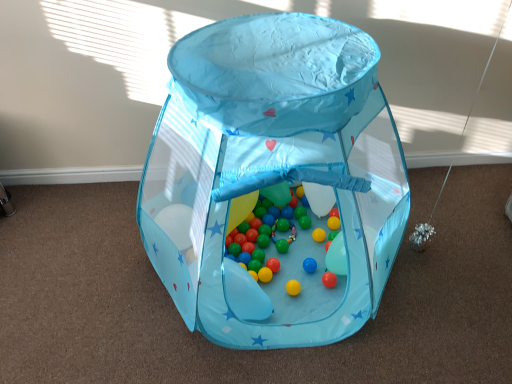
Question: Is transparent fabric play tent at center, which ranks as the second toy in bottom-to-top order, not close to translucent plastic balloon at center?

Choices:
 (A) yes
 (B) no

Answer: (B)

Question: Considering the relative sizes of transparent fabric play tent at center, which is the 1th toy in top-to-bottom order, and translucent plastic balloon at center in the image provided, is transparent fabric play tent at center, which is the 1th toy in top-to-bottom order, taller than translucent plastic balloon at center?

Choices:
 (A) yes
 (B) no

Answer: (A)

Question: Can you confirm if transparent fabric play tent at center, which is the 1th toy in top-to-bottom order, is positioned to the right of translucent plastic balloon at center?

Choices:
 (A) yes
 (B) no

Answer: (A)

Question: Is transparent fabric play tent at center, which ranks as the second toy in bottom-to-top order, positioned before translucent plastic balloon at center?

Choices:
 (A) no
 (B) yes

Answer: (B)

Question: Could you tell me if transparent fabric play tent at center, which ranks as the second toy in bottom-to-top order, is facing translucent plastic balloon at center?

Choices:
 (A) no
 (B) yes

Answer: (A)

Question: Choose the correct answer: Is translucent plastic balloon at center inside transparent fabric play tent at center, which is the 1th toy in top-to-bottom order, or outside it?

Choices:
 (A) inside
 (B) outside

Answer: (A)

Question: Based on their sizes in the image, would you say translucent plastic balloon at center is bigger or smaller than transparent fabric play tent at center, which ranks as the second toy in bottom-to-top order?

Choices:
 (A) small
 (B) big

Answer: (A)

Question: Is translucent plastic balloon at center wider or thinner than transparent fabric play tent at center, which is the 1th toy in top-to-bottom order?

Choices:
 (A) wide
 (B) thin

Answer: (B)

Question: In terms of height, does translucent plastic balloon at center look taller or shorter compared to transparent fabric play tent at center, which is the 1th toy in top-to-bottom order?

Choices:
 (A) short
 (B) tall

Answer: (A)

Question: From a real-world perspective, is multicolored glossy balls at center, positioned as the 2th toy in top-to-bottom order, positioned above or below transparent fabric play tent at center, which ranks as the second toy in bottom-to-top order?

Choices:
 (A) above
 (B) below

Answer: (B)

Question: Would you say multicolored glossy balls at center, which ranks as the first toy in bottom-to-top order, is to the left or to the right of transparent fabric play tent at center, which is the 1th toy in top-to-bottom order, in the picture?

Choices:
 (A) right
 (B) left

Answer: (A)

Question: From the image's perspective, is multicolored glossy balls at center, which ranks as the first toy in bottom-to-top order, positioned above or below transparent fabric play tent at center, which ranks as the second toy in bottom-to-top order?

Choices:
 (A) below
 (B) above

Answer: (A)

Question: Is multicolored glossy balls at center, which ranks as the first toy in bottom-to-top order, in front of or behind transparent fabric play tent at center, which is the 1th toy in top-to-bottom order, in the image?

Choices:
 (A) behind
 (B) front

Answer: (A)

Question: From the image's perspective, is transparent fabric play tent at center, which ranks as the second toy in bottom-to-top order, positioned above or below translucent plastic balloon at center?

Choices:
 (A) below
 (B) above

Answer: (B)

Question: From a real-world perspective, relative to translucent plastic balloon at center, is transparent fabric play tent at center, which ranks as the second toy in bottom-to-top order, vertically above or below?

Choices:
 (A) below
 (B) above

Answer: (B)